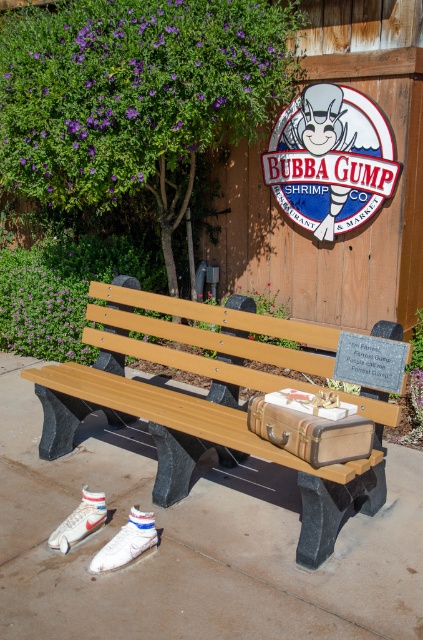
Based on the photo, you are a delivery person who needs to place a package between the wooden signboard at upper center and the white suede shoe at lower left. The package requires a space of 3 meters. Is there enough space?

The distance between the wooden signboard at upper center and the white suede shoe at lower left is 3.27 meters, which is sufficient to accommodate the 3 meter space requirement for the package.

From the picture: Based on the scene at the Bubba Gump Shrimp Co., can you determine if the wooden bench at center is wider than the wooden signboard at upper center?

The wooden bench at center is wider than the wooden signboard at upper center according to the description.